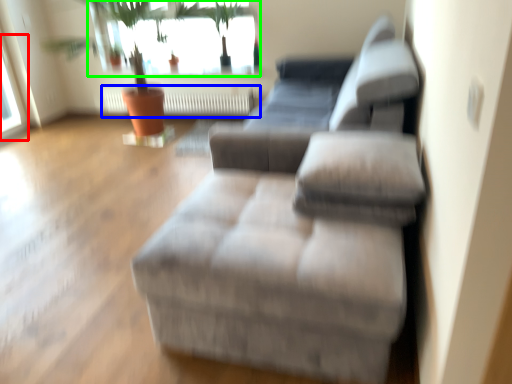
Question: Which object is the closest to the window (highlighted by a red box)? Choose among these: radiator (highlighted by a blue box) or window (highlighted by a green box).

Choices:
 (A) radiator
 (B) window

Answer: (B)